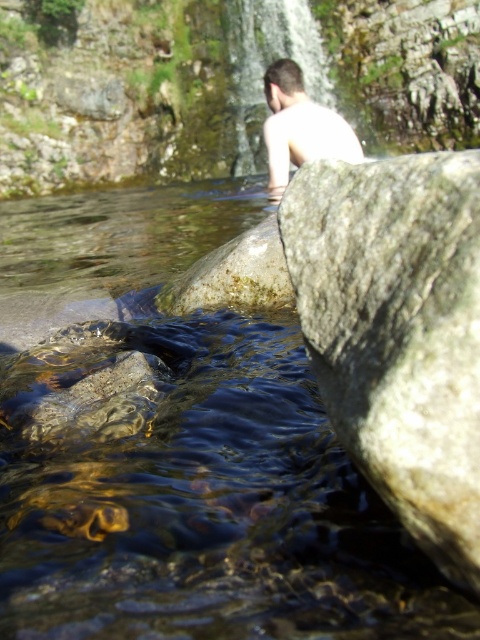
You are a photographer trying to capture the light skin human at center in the image. Since the transparent water at center is between you and the human, will you be able to see the human clearly through the water?

The transparent water at center is in front of the light skin human at center, so yes, you can see the human clearly through the water as it is transparent.

You are a photographer wanting to capture the light skin human at center in the image. To get the best shot, you need to know if the transparent water at center is between the human and the camera. Based on the scene description, can you determine this?

Yes, the transparent water at center is located below the light skin human at center, so it is between the human and the camera.